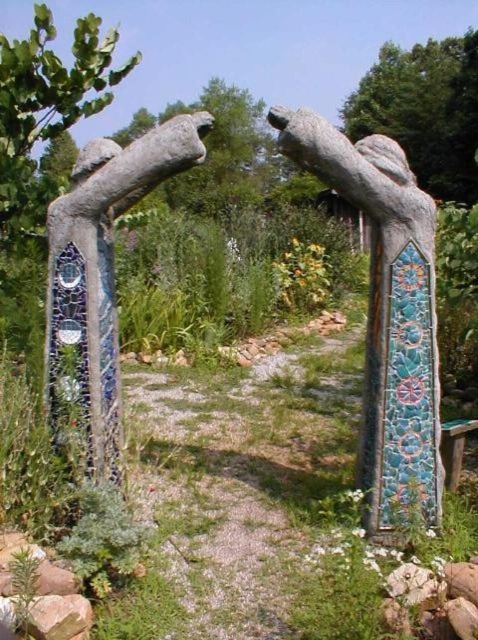
Which is more to the right, mosaic stone statue at center or mosaic tile arch at center?

From the viewer's perspective, mosaic stone statue at center appears more on the right side.

Is mosaic stone statue at center smaller than mosaic tile arch at center?

No.

Between point (425, 417) and point (209, 120), which one is positioned in front?

Point (209, 120) is in front.

At what (x,y) coordinates should I click in order to perform the action: click on mosaic stone statue at center. Please return your answer as a coordinate pair (x, y). Looking at the image, I should click on (387, 312).